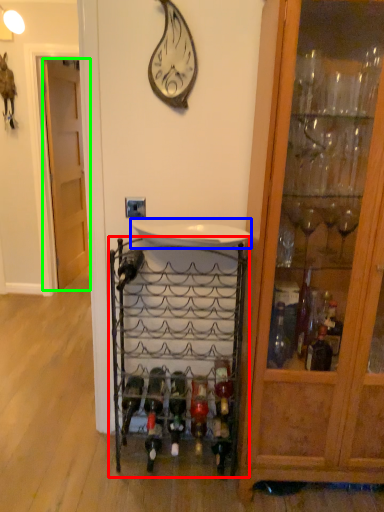
Question: Which is nearer to the shelf (highlighted by a red box)? sink (highlighted by a blue box) or door (highlighted by a green box).

Choices:
 (A) sink
 (B) door

Answer: (A)